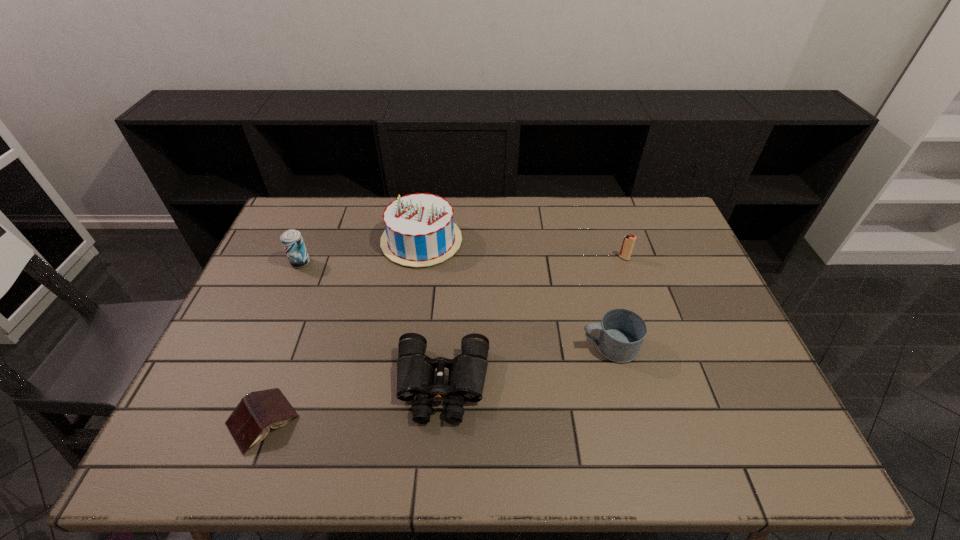
You are a GUI agent. You are given a task and a screenshot of the screen. Output one action in this format:
    pyautogui.click(x=<x>, y=<y>)
    Task: Click on the vacant region located 0.050m on the side of the mug with the handle
    The image size is (960, 540).
    Given the screenshot: What is the action you would take?
    pyautogui.click(x=563, y=346)

You are a GUI agent. You are given a task and a screenshot of the screen. Output one action in this format:
    pyautogui.click(x=<x>, y=<y>)
    Task: Click on the free space located 0.080m on the side of the mug with the handle
    The width and height of the screenshot is (960, 540).
    Given the screenshot: What is the action you would take?
    pyautogui.click(x=551, y=346)

The image size is (960, 540). Find the location of `free space located 0.050m through the eyepieces of the binoculars`. free space located 0.050m through the eyepieces of the binoculars is located at coordinates tap(439, 448).

Where is `vacant space situated on the back of the book`? vacant space situated on the back of the book is located at coordinates (304, 308).

This screenshot has height=540, width=960. Find the location of `object that is at the far edge`. object that is at the far edge is located at coordinates (x=420, y=231).

Locate an element on the screen. This screenshot has width=960, height=540. object present at the near edge is located at coordinates (249, 423).

Where is `beer can situated at the left edge`? beer can situated at the left edge is located at coordinates (292, 241).

I want to click on book present at the left edge, so click(x=249, y=423).

Where is `object at the near left corner`? This screenshot has height=540, width=960. object at the near left corner is located at coordinates (249, 423).

Locate an element on the screen. vacant region at the far edge is located at coordinates (530, 196).